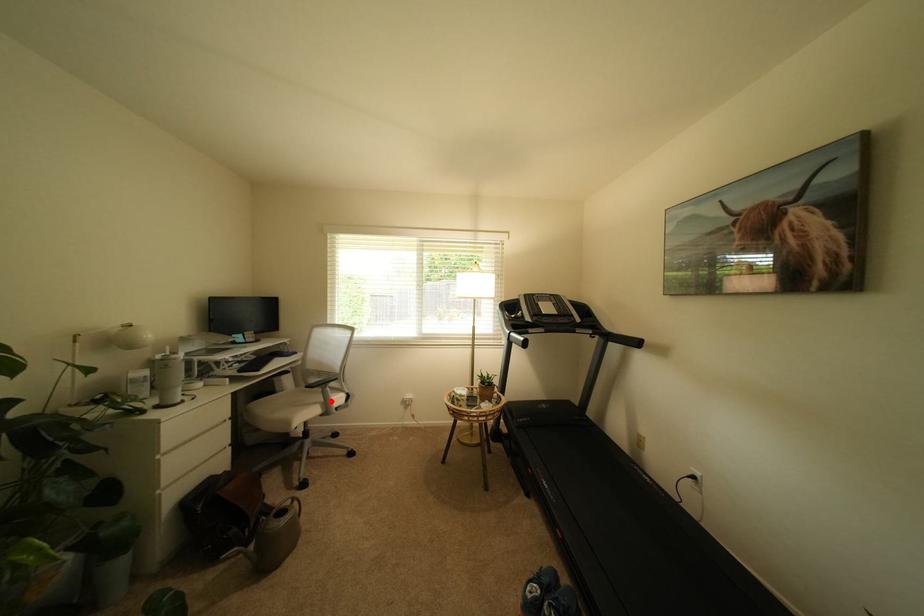
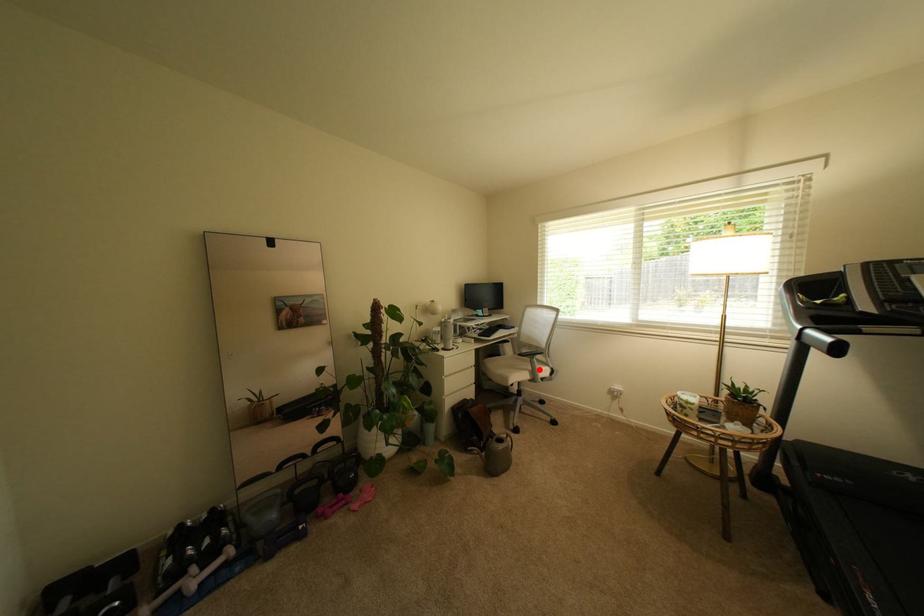
I am providing you with two images of the same scene from different viewpoints. A red point is marked on the first image and another point is marked on the second image. Does the point marked in image1 correspond to the same location as the one in image2?

Yes